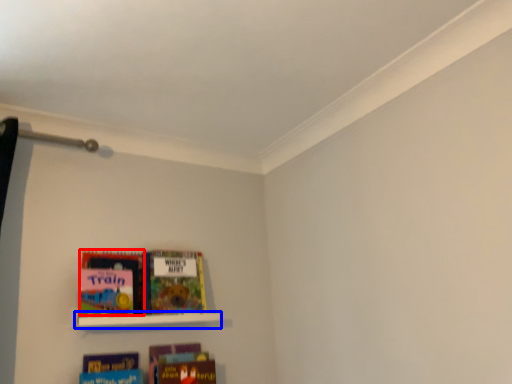
Question: Which point is closer to the camera, book (highlighted by a red box) or shelf (highlighted by a blue box)?

Choices:
 (A) book
 (B) shelf

Answer: (B)